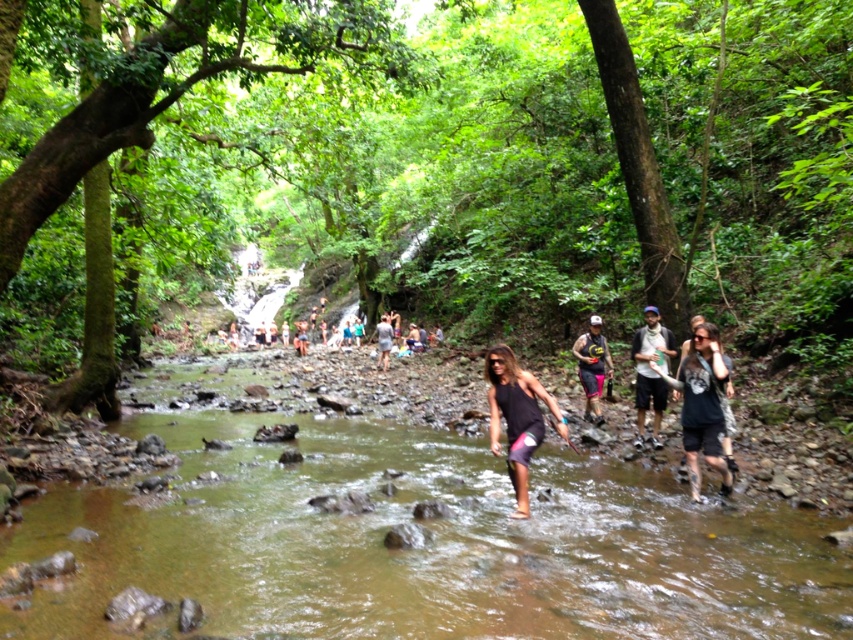
You are navigating through the forest stream and want to reach the waterfall area. You have two points marked as your path options. Which point should you choose to stay closer to the waterfall? The points are point 1 at coordinates point (244, 156) and point 2 at coordinates point (700, 364). Please explain your reasoning based on their positions.

You should choose point 2 at coordinates point (700, 364) because it is closer to the waterfall. Since point 1 is behind point 2, this means point 2 is positioned in front and nearer to the waterfall area.